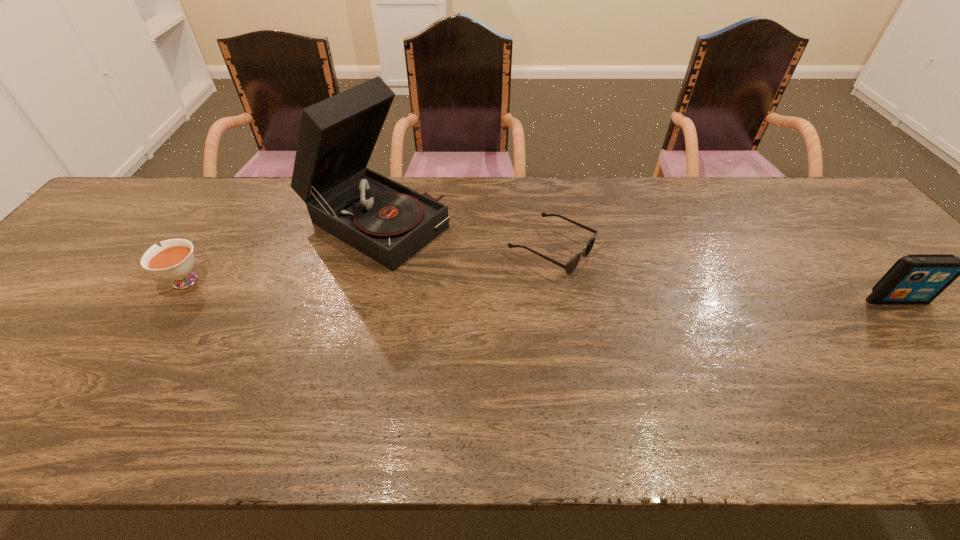
You are a GUI agent. You are given a task and a screenshot of the screen. Output one action in this format:
    pyautogui.click(x=<x>, y=<y>)
    Task: Click on the object present at the right edge
    The height and width of the screenshot is (540, 960).
    Given the screenshot: What is the action you would take?
    pyautogui.click(x=916, y=278)

This screenshot has height=540, width=960. In order to click on free spot at the far edge of the desktop in this screenshot , I will do `click(601, 221)`.

This screenshot has height=540, width=960. Find the location of `vacant position at the near edge of the desktop`. vacant position at the near edge of the desktop is located at coordinates (484, 364).

Where is `free space at the left edge of the desktop`? This screenshot has height=540, width=960. free space at the left edge of the desktop is located at coordinates click(x=115, y=234).

You are a GUI agent. You are given a task and a screenshot of the screen. Output one action in this format:
    pyautogui.click(x=<x>, y=<y>)
    Task: Click on the free spot at the far left corner of the desktop
    
    Given the screenshot: What is the action you would take?
    pyautogui.click(x=123, y=202)

This screenshot has width=960, height=540. In the image, there is a desktop. What are the coordinates of `free space at the far right corner` in the screenshot? It's located at (790, 192).

Find the location of a particular element. free space between the third shortest object and the phonograph_record is located at coordinates (636, 261).

Where is `free area in between the teacup and the rightmost object`? The width and height of the screenshot is (960, 540). free area in between the teacup and the rightmost object is located at coordinates (540, 291).

Identify the location of free spot between the phonograph_record and the second shortest object. (278, 252).

At what (x,y) coordinates should I click in order to perform the action: click on vacant point located between the third object from left to right and the phonograph_record. Please return your answer as a coordinate pair (x, y). Looking at the image, I should click on 463,236.